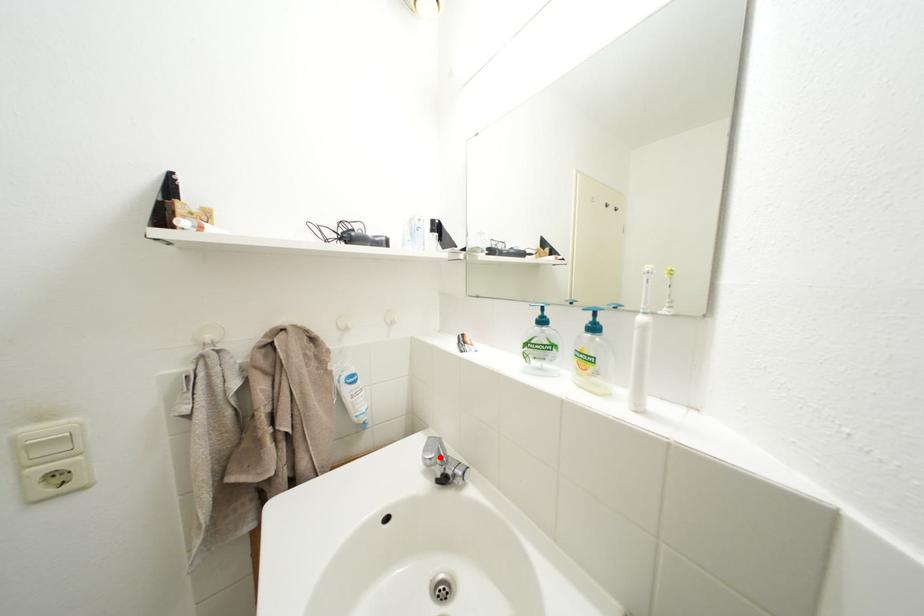
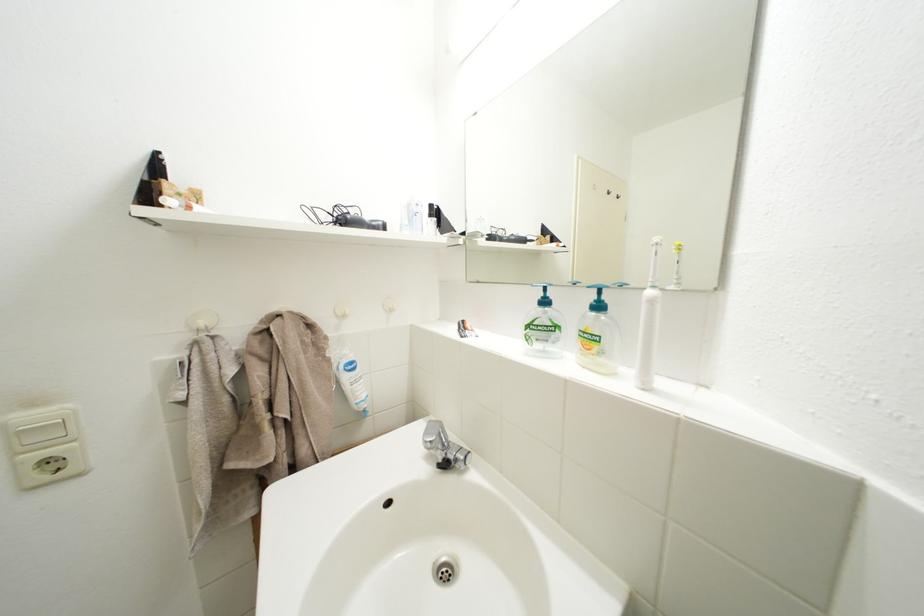
In the second image, find the point that corresponds to the highlighted location in the first image.

(441, 440)